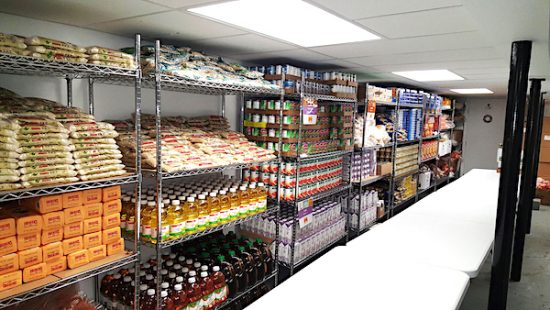
Where is `back wall`? back wall is located at coordinates (81, 96), (110, 98).